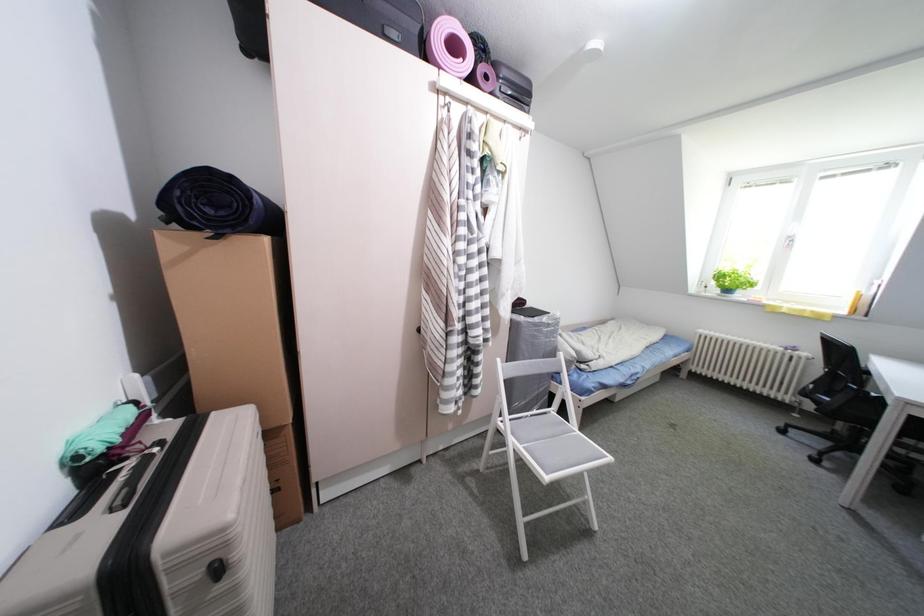
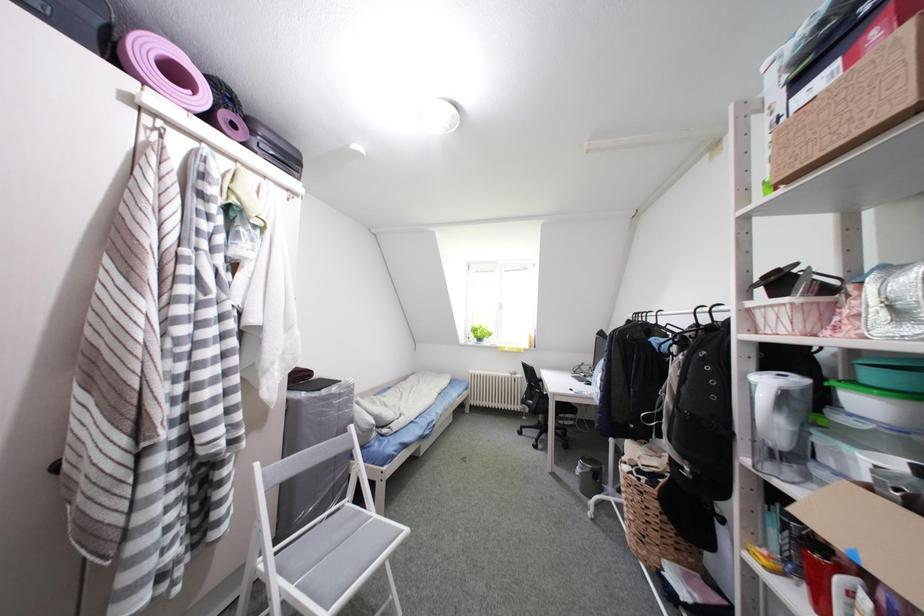
Question: The camera is either moving clockwise (left) or counter-clockwise (right) around the object. The first image is from the beginning of the video and the second image is from the end. Is the camera moving left or right when shooting the video?

Choices:
 (A) Left
 (B) Right

Answer: (A)